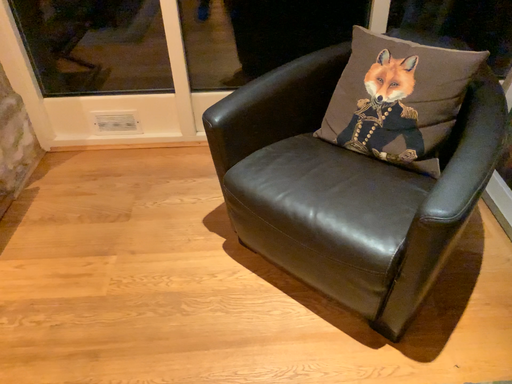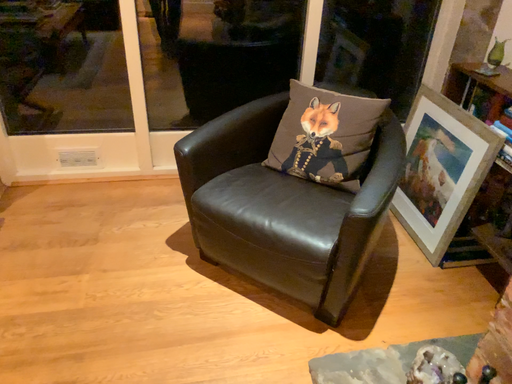
Question: Which way did the camera rotate in the video?

Choices:
 (A) rotated upward
 (B) rotated downward

Answer: (A)